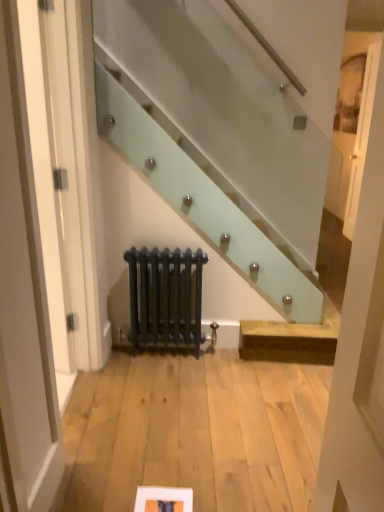
Locate an element on the screen. This screenshot has height=512, width=384. vacant region in front of matte black radiator at center is located at coordinates (165, 378).